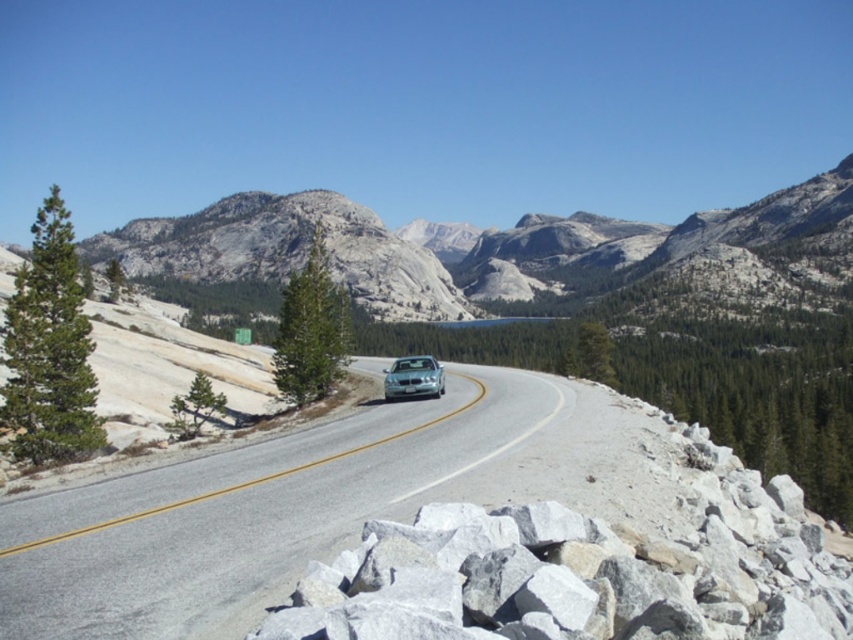
Does point (370, 412) come farther from viewer compared to point (387, 634)?

That is True.

Does silver metallic car at center have a greater height compared to gray rock at center?

Incorrect, silver metallic car at center's height is not larger of gray rock at center's.

At what (x,y) coordinates should I click in order to perform the action: click on silver metallic car at center. Please return your answer as a coordinate pair (x, y). Image resolution: width=853 pixels, height=640 pixels. Looking at the image, I should click on (247, 515).

Can you confirm if silver metallic car at center is positioned to the left of sleek silver sedan at center?

In fact, silver metallic car at center is to the right of sleek silver sedan at center.

Does silver metallic car at center have a lesser width compared to sleek silver sedan at center?

In fact, silver metallic car at center might be wider than sleek silver sedan at center.

Which is behind, point (65, 604) or point (410, 381)?

The point (410, 381) is behind.

This screenshot has width=853, height=640. What are the coordinates of `silver metallic car at center` in the screenshot? It's located at (247, 515).

Can you confirm if gray granite mountain at center is thinner than sleek silver sedan at center?

No, gray granite mountain at center is not thinner than sleek silver sedan at center.

Who is higher up, gray granite mountain at center or sleek silver sedan at center?

gray granite mountain at center is above.

Between point (654, 259) and point (389, 385), which one is positioned behind?

Point (654, 259)

Where is `gray granite mountain at center`? The image size is (853, 640). gray granite mountain at center is located at coordinates (509, 253).